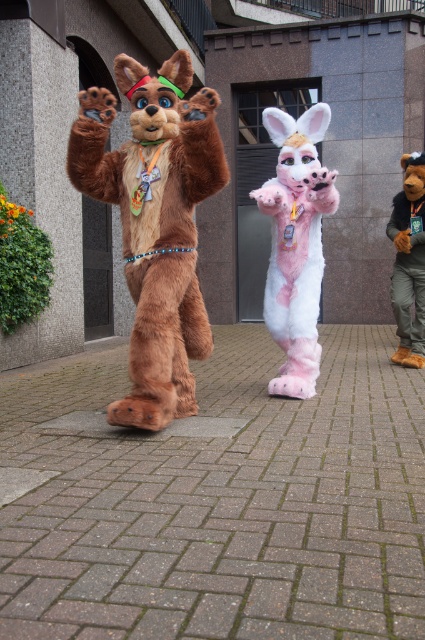
At what (x,y) coordinates should I click in order to perform the action: click on fuzzy pink fur at center. Please return your answer as a coordinate pair (x, y). Image resolution: width=425 pixels, height=640 pixels. Looking at the image, I should click on (155, 224).

Measure the distance between fuzzy pink fur at center and camera.

They are 11.29 feet apart.

Which is in front, point (138, 304) or point (396, 228)?

Point (138, 304)

I want to click on fuzzy pink fur at center, so click(x=155, y=224).

Which is more to the right, pink furry costume at center or fuzzy brown bear at right?

From the viewer's perspective, fuzzy brown bear at right appears more on the right side.

Does pink furry costume at center appear under fuzzy brown bear at right?

Yes.

Is point (289, 323) positioned after point (410, 198)?

No, it is not.

Locate an element on the screen. pink furry costume at center is located at coordinates (295, 243).

Can you confirm if fuzzy pink fur at center is positioned above pink furry costume at center?

Yes, fuzzy pink fur at center is above pink furry costume at center.

Which is more to the left, fuzzy pink fur at center or pink furry costume at center?

From the viewer's perspective, fuzzy pink fur at center appears more on the left side.

Locate an element on the screen. This screenshot has width=425, height=640. fuzzy pink fur at center is located at coordinates (155, 224).